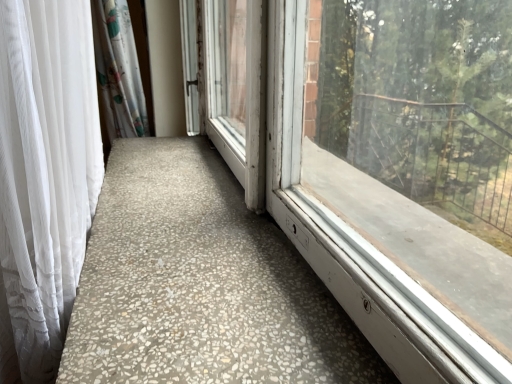
Question: Which is correct: white sheer curtain at left is inside speckled concrete floor at center, or outside of it?

Choices:
 (A) inside
 (B) outside

Answer: (B)

Question: In terms of size, does white sheer curtain at left appear bigger or smaller than speckled concrete floor at center?

Choices:
 (A) small
 (B) big

Answer: (B)

Question: Considering their positions, is white sheer curtain at left located in front of or behind speckled concrete floor at center?

Choices:
 (A) front
 (B) behind

Answer: (A)

Question: Looking at the image, does speckled concrete floor at center seem bigger or smaller compared to white sheer curtain at left?

Choices:
 (A) big
 (B) small

Answer: (B)

Question: From their relative heights in the image, would you say speckled concrete floor at center is taller or shorter than white sheer curtain at left?

Choices:
 (A) short
 (B) tall

Answer: (A)

Question: From the image's perspective, relative to white sheer curtain at left, is speckled concrete floor at center above or below?

Choices:
 (A) below
 (B) above

Answer: (B)

Question: Is point (367, 370) closer or farther from the camera than point (61, 14)?

Choices:
 (A) farther
 (B) closer

Answer: (B)